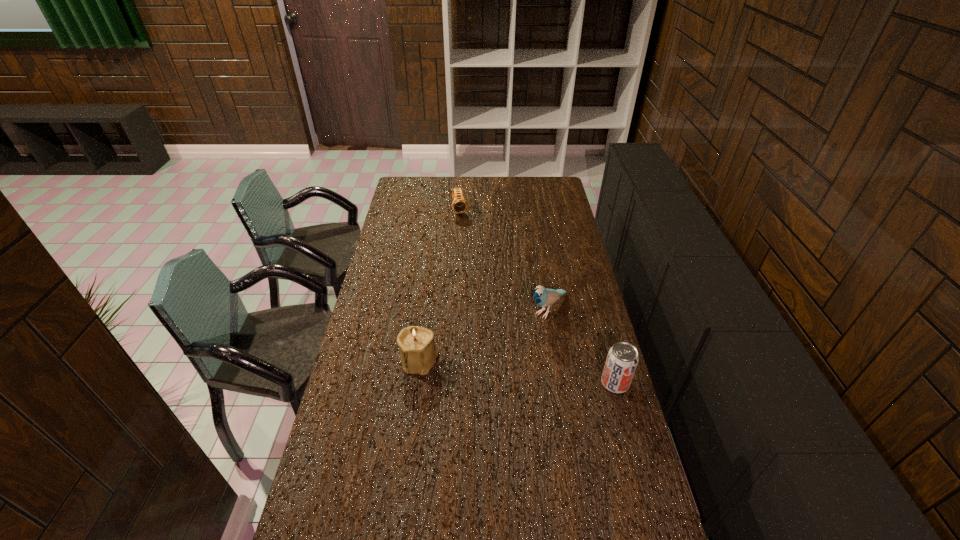
Identify the location of candle_holder. This screenshot has height=540, width=960. (418, 353).

Locate an element on the screen. soda can is located at coordinates (622, 359).

The height and width of the screenshot is (540, 960). In order to click on the farthest object in this screenshot , I will do (x=459, y=205).

Find the location of `the third object from right to left`. the third object from right to left is located at coordinates (459, 205).

Find the location of a particular element. The image size is (960, 540). the third object from left to right is located at coordinates (543, 297).

At what (x,y) coordinates should I click in order to perform the action: click on the second farthest object. Please return your answer as a coordinate pair (x, y). Looking at the image, I should click on (543, 297).

Where is `vacant area located 0.300m on the front of the candle_holder`? Image resolution: width=960 pixels, height=540 pixels. vacant area located 0.300m on the front of the candle_holder is located at coordinates (406, 462).

You are a GUI agent. You are given a task and a screenshot of the screen. Output one action in this format:
    pyautogui.click(x=<x>, y=<y>)
    Task: Click on the vacant region located on the back of the rightmost object
    Image resolution: width=960 pixels, height=540 pixels.
    Given the screenshot: What is the action you would take?
    pyautogui.click(x=603, y=340)

In order to click on free location located 0.360m on the face of the shortest object in this screenshot , I will do `click(474, 263)`.

Where is `free space located 0.380m on the face of the shortest object`? free space located 0.380m on the face of the shortest object is located at coordinates (475, 266).